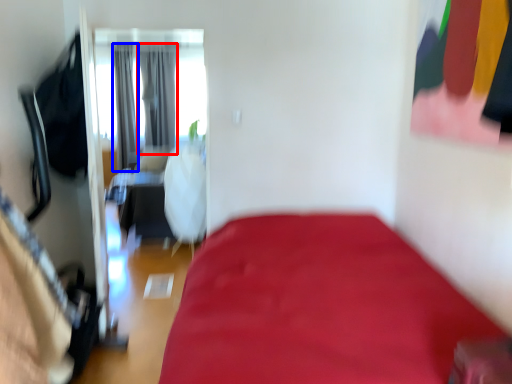
Question: Which point is closer to the camera, curtain (highlighted by a red box) or curtain (highlighted by a blue box)?

Choices:
 (A) curtain
 (B) curtain

Answer: (B)